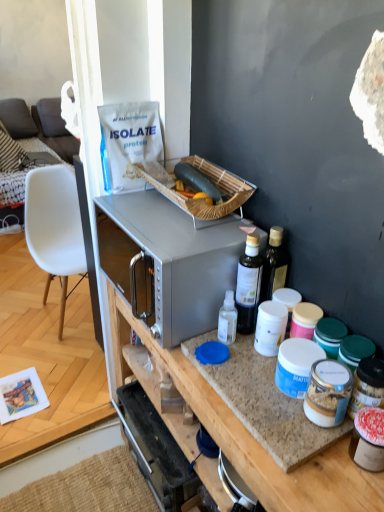
Where is `vacant space situated on the left part of bamboo picnic basket at upper center`? This screenshot has height=512, width=384. vacant space situated on the left part of bamboo picnic basket at upper center is located at coordinates (130, 207).